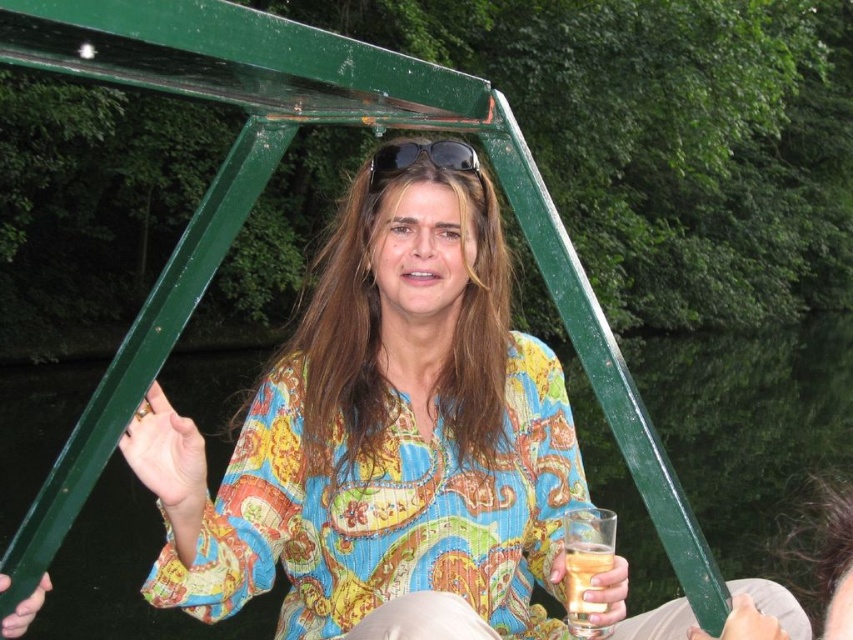
Does transparent glass water at center have a lesser width compared to black plastic sunglasses at upper center?

No, transparent glass water at center is not thinner than black plastic sunglasses at upper center.

Who is positioned more to the left, transparent glass water at center or black plastic sunglasses at upper center?

Positioned to the left is black plastic sunglasses at upper center.

Between point (647, 342) and point (375, 184), which one is positioned in front?

Point (375, 184) is more forward.

At what (x,y) coordinates should I click in order to perform the action: click on transparent glass water at center. Please return your answer as a coordinate pair (x, y). The image size is (853, 640). Looking at the image, I should click on (751, 432).

Is translucent glass at lower center below black plastic sunglasses at upper center?

Indeed, translucent glass at lower center is positioned under black plastic sunglasses at upper center.

Is translucent glass at lower center to the left of black plastic sunglasses at upper center from the viewer's perspective?

In fact, translucent glass at lower center is to the right of black plastic sunglasses at upper center.

Image resolution: width=853 pixels, height=640 pixels. I want to click on translucent glass at lower center, so click(x=585, y=580).

What do you see at coordinates (751, 432) in the screenshot? I see `transparent glass water at center` at bounding box center [751, 432].

Does transparent glass water at center have a larger size compared to translucent glass at lower center?

Yes.

The width and height of the screenshot is (853, 640). Find the location of `transparent glass water at center`. transparent glass water at center is located at coordinates (751, 432).